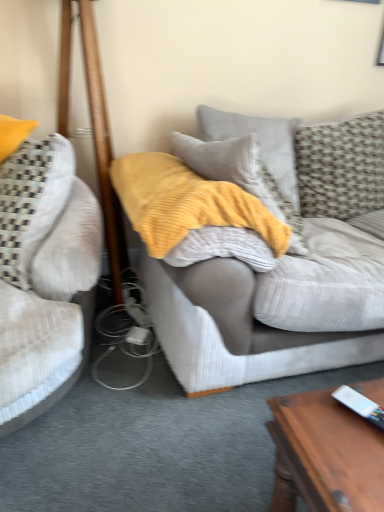
Question: Is textured gray couch at center, the first studio couch when ordered from right to left, not near textured gray pillow at upper right, acting as the 1th pillow starting from the left?

Choices:
 (A) yes
 (B) no

Answer: (B)

Question: Does textured gray couch at center, which is the 2th studio couch in left-to-right order, have a lesser height compared to textured gray pillow at upper right, placed as the second pillow when sorted from right to left?

Choices:
 (A) no
 (B) yes

Answer: (A)

Question: Could you tell me if textured gray couch at center, which is the 2th studio couch in left-to-right order, is facing textured gray pillow at upper right, acting as the 1th pillow starting from the left?

Choices:
 (A) yes
 (B) no

Answer: (B)

Question: Is the position of textured gray couch at center, the first studio couch when ordered from right to left, less distant than that of textured gray pillow at upper right, placed as the second pillow when sorted from right to left?

Choices:
 (A) yes
 (B) no

Answer: (A)

Question: From a real-world perspective, is textured gray couch at center, which is the 2th studio couch in left-to-right order, physically above textured gray pillow at upper right, acting as the 1th pillow starting from the left?

Choices:
 (A) yes
 (B) no

Answer: (B)

Question: Is textured gray couch at center, which is the 2th studio couch in left-to-right order, bigger than textured gray pillow at upper right, acting as the 1th pillow starting from the left?

Choices:
 (A) no
 (B) yes

Answer: (B)

Question: Is yellow textured blanket at center to the right of wooden pole at left from the viewer's perspective?

Choices:
 (A) no
 (B) yes

Answer: (B)

Question: Would you say yellow textured blanket at center is outside wooden pole at left?

Choices:
 (A) yes
 (B) no

Answer: (A)

Question: Are yellow textured blanket at center and wooden pole at left making contact?

Choices:
 (A) yes
 (B) no

Answer: (B)

Question: Is yellow textured blanket at center wider than wooden pole at left?

Choices:
 (A) yes
 (B) no

Answer: (A)

Question: Are yellow textured blanket at center and wooden pole at left located far from each other?

Choices:
 (A) yes
 (B) no

Answer: (B)

Question: Is yellow textured blanket at center aimed at wooden pole at left?

Choices:
 (A) no
 (B) yes

Answer: (A)

Question: Is textured beige pillow at upper right, the first pillow when ordered from right to left, bigger than wooden pole at left?

Choices:
 (A) no
 (B) yes

Answer: (A)